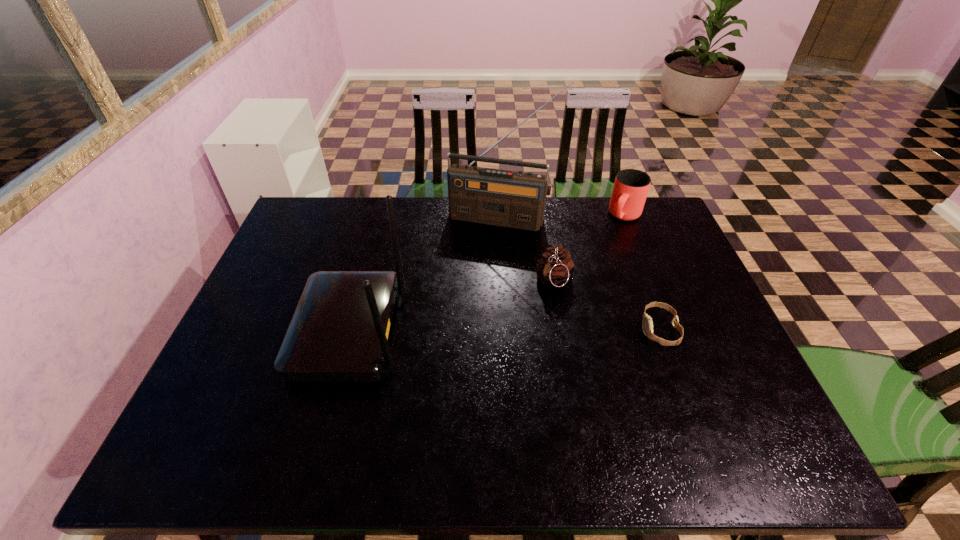
The width and height of the screenshot is (960, 540). Identify the location of free space on the desktop that is between the fourth shortest object and the watch and is positioned on the handle side of the cup. (548, 330).

Where is `free space on the desktop that is between the router and the shortest object and is positioned on the front-facing side of the tallest object`? The image size is (960, 540). free space on the desktop that is between the router and the shortest object and is positioned on the front-facing side of the tallest object is located at coordinates (464, 330).

Identify the location of free space on the desktop that is between the router and the watch and is positioned with a leaf charm attached to the pinecone. (521, 330).